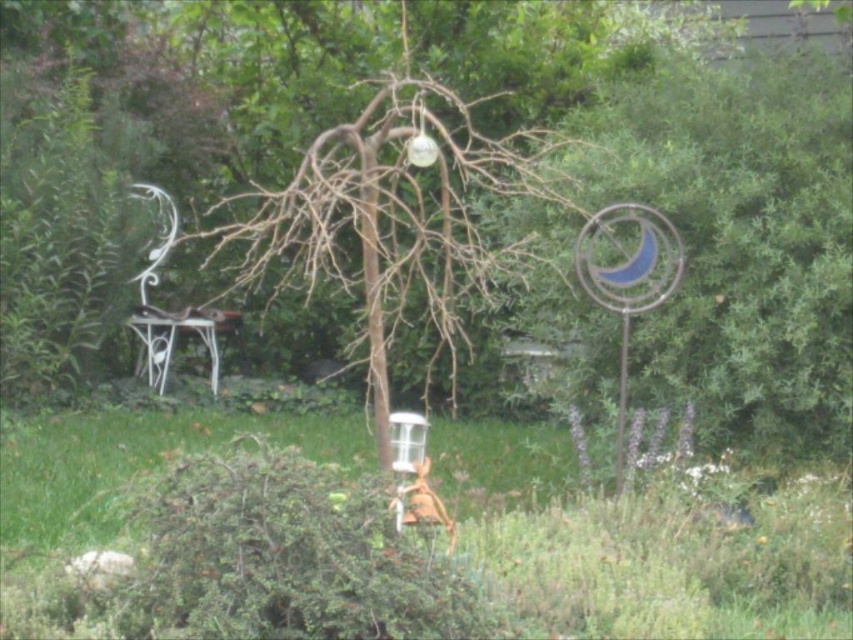
Identify the location of metallic wire sculpture at right. (740, 240).

Is point (839, 161) farther from viewer compared to point (450, 150)?

No, it is not.

Does point (637, 166) come farther from viewer compared to point (421, 113)?

Yes, point (637, 166) is farther from viewer.

Where is `metallic wire sculpture at right`? The height and width of the screenshot is (640, 853). metallic wire sculpture at right is located at coordinates [740, 240].

Is metallic wire sculpture at right further to the viewer compared to white wrought iron chair at left?

No.

Who is shorter, metallic wire sculpture at right or white wrought iron chair at left?

Answer: With less height is white wrought iron chair at left.

Is point (683, 148) farther from viewer compared to point (165, 317)?

No, (683, 148) is in front of (165, 317).

The height and width of the screenshot is (640, 853). I want to click on metallic wire sculpture at right, so click(740, 240).

Between brown wood tree at center and white wrought iron chair at left, which one is positioned higher?

white wrought iron chair at left

Which is in front, point (381, 150) or point (234, 317)?

Point (381, 150)

Looking at this image, who is more distant from viewer, (x=456, y=268) or (x=172, y=333)?

The point (x=172, y=333) is more distant.

Find the location of `brown wood tree at center`. brown wood tree at center is located at coordinates click(390, 218).